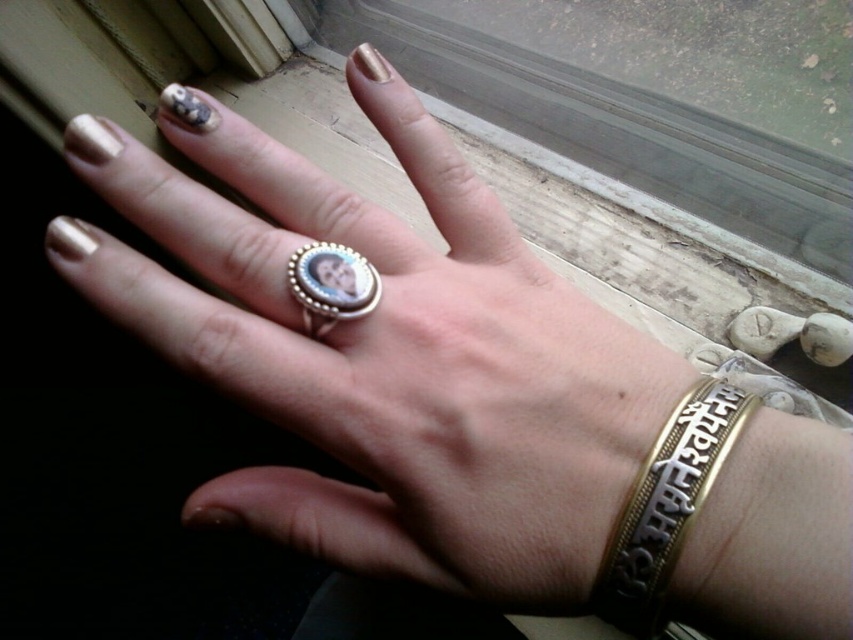
Question: Is transparent glass window at upper center below silver/golden ring at center?

Choices:
 (A) yes
 (B) no

Answer: (B)

Question: Which of the following is the farthest from the observer?

Choices:
 (A) matte silver ring at center
 (B) silver/golden ring at center
 (C) gold textured bracelet at lower right
 (D) transparent glass window at upper center

Answer: (D)

Question: Can you confirm if matte silver ring at center is positioned above silver/golden ring at center?

Choices:
 (A) yes
 (B) no

Answer: (B)

Question: Which object is positioned closest to the gold textured bracelet at lower right?

Choices:
 (A) transparent glass window at upper center
 (B) matte silver ring at center

Answer: (B)

Question: Is transparent glass window at upper center above silver/golden ring at center?

Choices:
 (A) yes
 (B) no

Answer: (A)

Question: Which object appears closest to the camera in this image?

Choices:
 (A) transparent glass window at upper center
 (B) silver/golden ring at center
 (C) matte silver ring at center

Answer: (C)